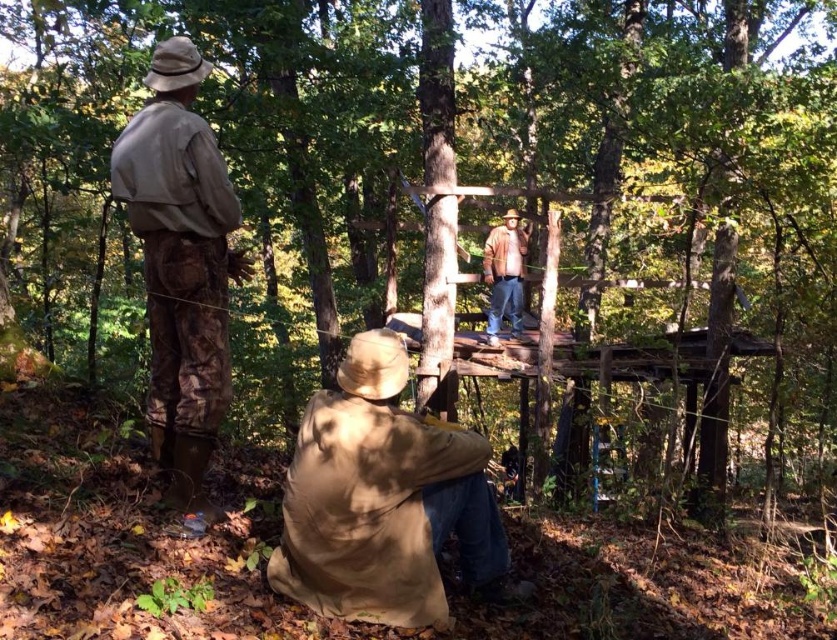
Does tan fabric jacket at lower center appear on the right side of brown leather jacket at upper center?

Incorrect, tan fabric jacket at lower center is not on the right side of brown leather jacket at upper center.

Identify the location of tan fabric jacket at lower center. The image size is (837, 640). (383, 499).

The image size is (837, 640). Identify the location of tan fabric jacket at lower center. (383, 499).

Which is behind, point (440, 612) or point (208, 444)?

The point (208, 444) is behind.

Which of these two, tan fabric jacket at lower center or camouflage pants at left, stands shorter?

tan fabric jacket at lower center is shorter.

Between point (458, 524) and point (165, 184), which one is positioned in front?

Point (165, 184) is more forward.

The width and height of the screenshot is (837, 640). I want to click on tan fabric jacket at lower center, so click(x=383, y=499).

Between camouflage pants at left and brown leather jacket at upper center, which one is positioned higher?

brown leather jacket at upper center is higher up.

The width and height of the screenshot is (837, 640). What are the coordinates of `camouflage pants at left` in the screenshot? It's located at click(x=181, y=264).

At what (x,y) coordinates should I click in order to perform the action: click on camouflage pants at left. Please return your answer as a coordinate pair (x, y). This screenshot has height=640, width=837. Looking at the image, I should click on (181, 264).